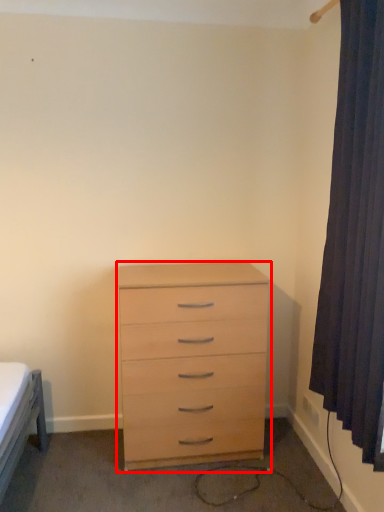
Question: Considering the relative positions of chest of drawers (annotated by the red box) and curtain in the image provided, where is chest of drawers (annotated by the red box) located with respect to the staircase?

Choices:
 (A) left
 (B) right

Answer: (A)